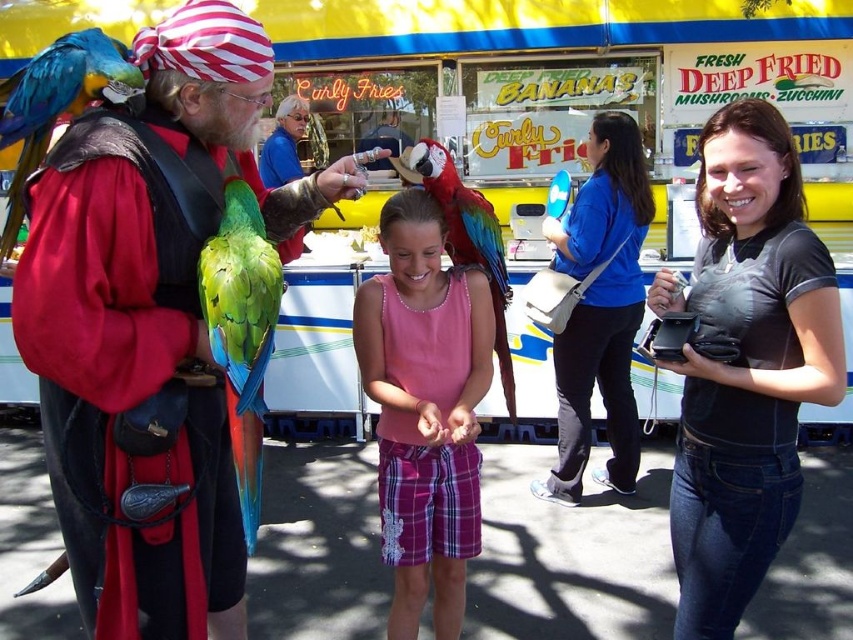
Which of these two, pink fabric tank top at center or blue-green feathered parrot at left, stands taller?

With more height is pink fabric tank top at center.

Who is higher up, pink fabric tank top at center or blue-green feathered parrot at left?

blue-green feathered parrot at left is higher up.

Where is `pink fabric tank top at center`? This screenshot has width=853, height=640. pink fabric tank top at center is located at coordinates (424, 410).

You are a GUI agent. You are given a task and a screenshot of the screen. Output one action in this format:
    pyautogui.click(x=<x>, y=<y>)
    Task: Click on the matte black vest at center
    The height and width of the screenshot is (640, 853).
    Given the screenshot: What is the action you would take?
    pyautogui.click(x=151, y=326)

Who is more distant from viewer, (247, 20) or (604, 161)?

The point (604, 161) is more distant.

The width and height of the screenshot is (853, 640). What are the coordinates of `matte black vest at center` in the screenshot? It's located at (151, 326).

Who is lower down, matte black vest at center or multicolored feathered parrot at center?

matte black vest at center

This screenshot has height=640, width=853. What do you see at coordinates (151, 326) in the screenshot? I see `matte black vest at center` at bounding box center [151, 326].

The image size is (853, 640). I want to click on matte black vest at center, so click(151, 326).